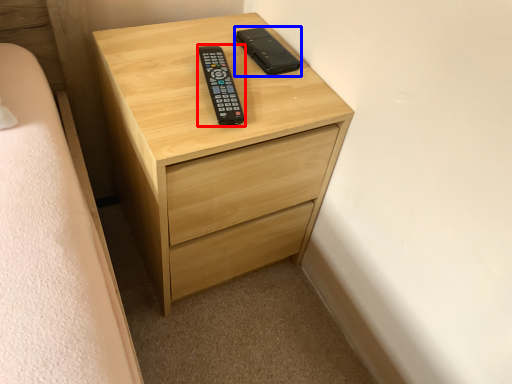
Question: Which object appears farthest to the camera in this image, control (highlighted by a red box) or control (highlighted by a blue box)?

Choices:
 (A) control
 (B) control

Answer: (B)